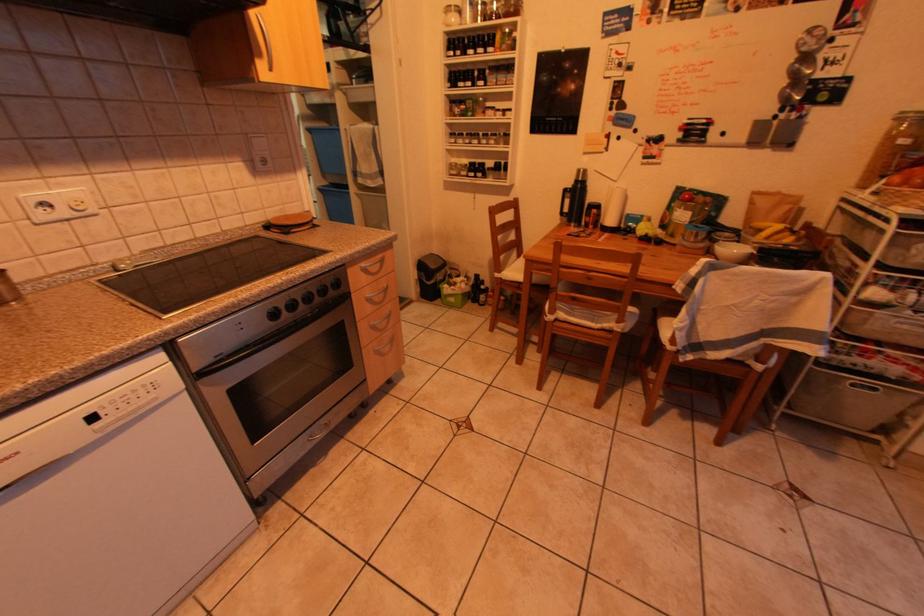
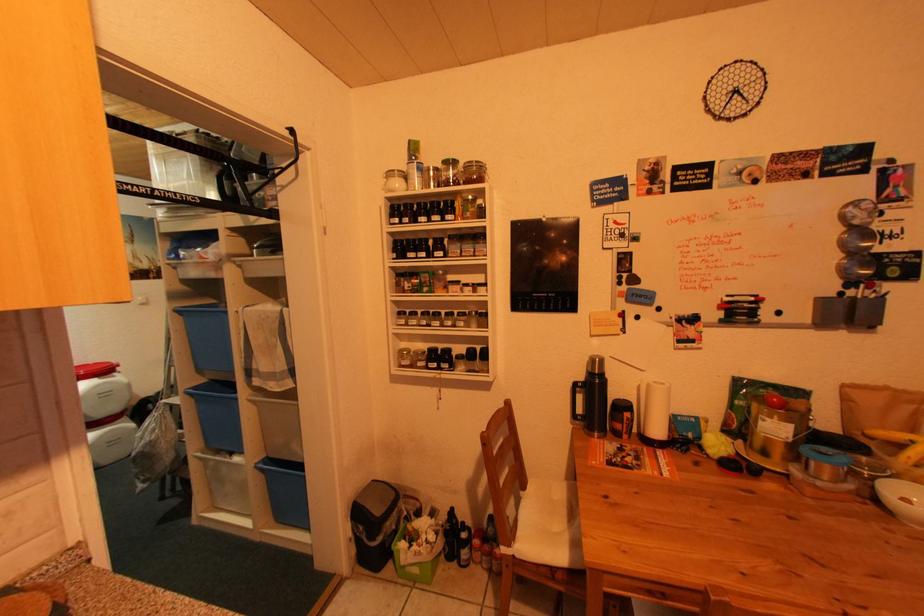
Question: How did the camera likely rotate?

Choices:
 (A) Left
 (B) Right
 (C) Up
 (D) Down

Answer: (C)